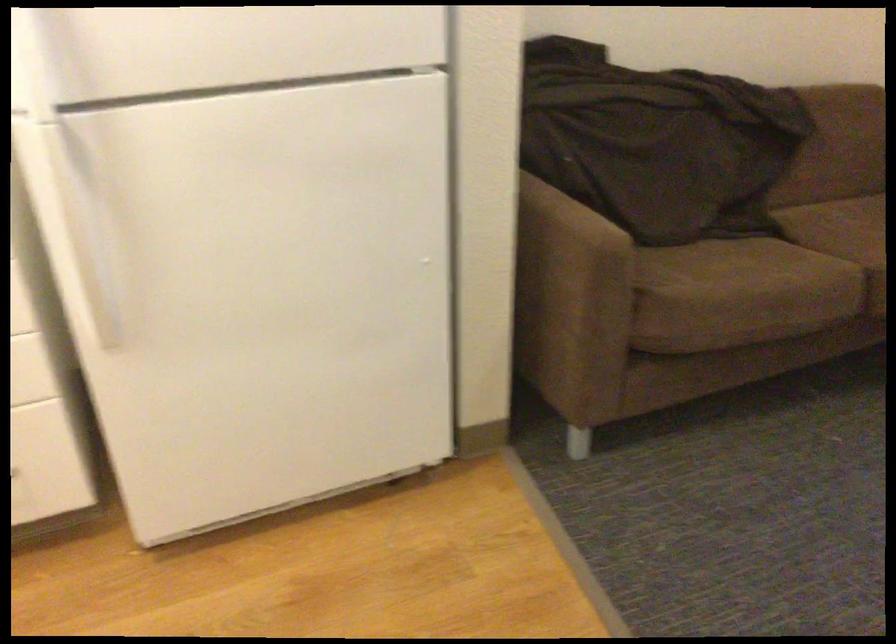
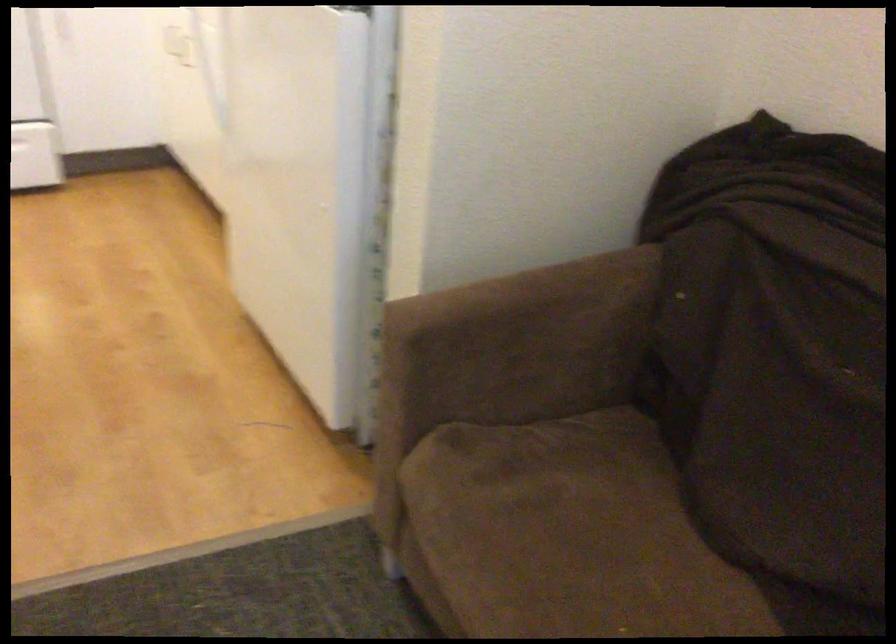
Where in the second image is the point corresponding to [567,207] from the first image?

(533, 310)